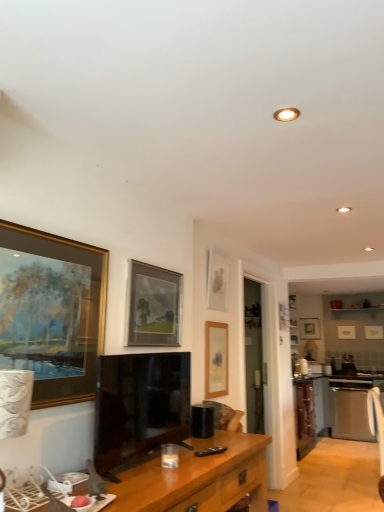
Question: Which direction should I rotate to look at matte glass picture frame at upper center, which is counted as the 2th picture frame, starting from the left?

Choices:
 (A) right
 (B) left

Answer: (B)

Question: Is wooden desk at lower center oriented away from white glossy microwave at right, the 1th appliance positioned from the back?

Choices:
 (A) yes
 (B) no

Answer: (B)

Question: Is wooden desk at lower center further to camera compared to white glossy microwave at right, the 2th appliance positioned from the left?

Choices:
 (A) no
 (B) yes

Answer: (A)

Question: Is white glossy microwave at right, the 1th appliance positioned from the back, inside wooden desk at lower center?

Choices:
 (A) no
 (B) yes

Answer: (A)

Question: Is wooden desk at lower center aimed at white glossy microwave at right, the 1th appliance positioned from the back?

Choices:
 (A) no
 (B) yes

Answer: (A)

Question: From a real-world perspective, is wooden desk at lower center below white glossy microwave at right, placed as the second appliance when sorted from front to back?

Choices:
 (A) no
 (B) yes

Answer: (B)

Question: Is wooden desk at lower center at the left side of white glossy microwave at right, which is counted as the 2th appliance, starting from the top?

Choices:
 (A) yes
 (B) no

Answer: (A)

Question: Are matte glass picture frame at upper center, which is the sixth picture frame from back to front, and matte gold picture frame at upper right, acting as the second picture frame starting from the right, far apart?

Choices:
 (A) no
 (B) yes

Answer: (B)

Question: Is matte glass picture frame at upper center, which is the sixth picture frame from back to front, further to the viewer compared to matte gold picture frame at upper right, acting as the second picture frame starting from the right?

Choices:
 (A) yes
 (B) no

Answer: (B)

Question: Is matte glass picture frame at upper center, which is counted as the 2th picture frame, starting from the left, looking in the opposite direction of matte gold picture frame at upper right, acting as the second picture frame starting from the right?

Choices:
 (A) yes
 (B) no

Answer: (B)

Question: From a real-world perspective, is matte glass picture frame at upper center, positioned as the 6th picture frame in right-to-left order, on matte gold picture frame at upper right, the 2th picture frame when ordered from back to front?

Choices:
 (A) yes
 (B) no

Answer: (B)

Question: Does matte glass picture frame at upper center, which is the sixth picture frame from back to front, have a lesser height compared to matte gold picture frame at upper right, which appears as the sixth picture frame when viewed from the left?

Choices:
 (A) yes
 (B) no

Answer: (B)

Question: Considering the relative sizes of matte glass picture frame at upper center, which is counted as the 2th picture frame, starting from the left, and matte gold picture frame at upper right, acting as the sixth picture frame starting from the front, in the image provided, is matte glass picture frame at upper center, which is counted as the 2th picture frame, starting from the left, smaller than matte gold picture frame at upper right, acting as the sixth picture frame starting from the front,?

Choices:
 (A) no
 (B) yes

Answer: (A)

Question: Can you confirm if matte gold picture frame at upper right, which appears as the sixth picture frame when viewed from the left, is bigger than stainless steel oven at right?

Choices:
 (A) no
 (B) yes

Answer: (A)